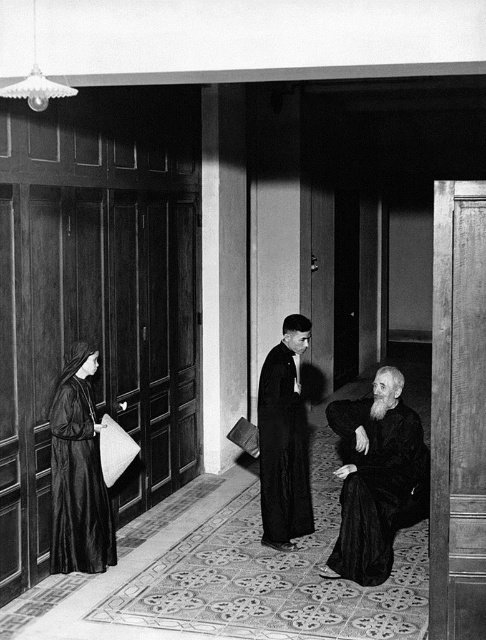
Is black matte robe at lower right closer to camera compared to matte black robe at left?

That is True.

Who is shorter, black matte robe at lower right or matte black robe at left?

With less height is black matte robe at lower right.

Identify the location of black matte robe at lower right. (377, 486).

Based on the photo, can you confirm if black matte robe at lower right is positioned below smooth black robe at center?

Indeed, black matte robe at lower right is positioned under smooth black robe at center.

Which is in front, point (359, 412) or point (294, 368)?

Point (359, 412)

Describe the element at coordinates (377, 486) in the screenshot. I see `black matte robe at lower right` at that location.

Identify the location of black matte robe at lower right. Image resolution: width=486 pixels, height=640 pixels. (377, 486).

Does matte black robe at left have a lesser height compared to smooth black robe at center?

Incorrect, matte black robe at left's height does not fall short of smooth black robe at center's.

Looking at this image, which of these two, matte black robe at left or smooth black robe at center, stands shorter?

smooth black robe at center is shorter.

The width and height of the screenshot is (486, 640). I want to click on matte black robe at left, so click(79, 472).